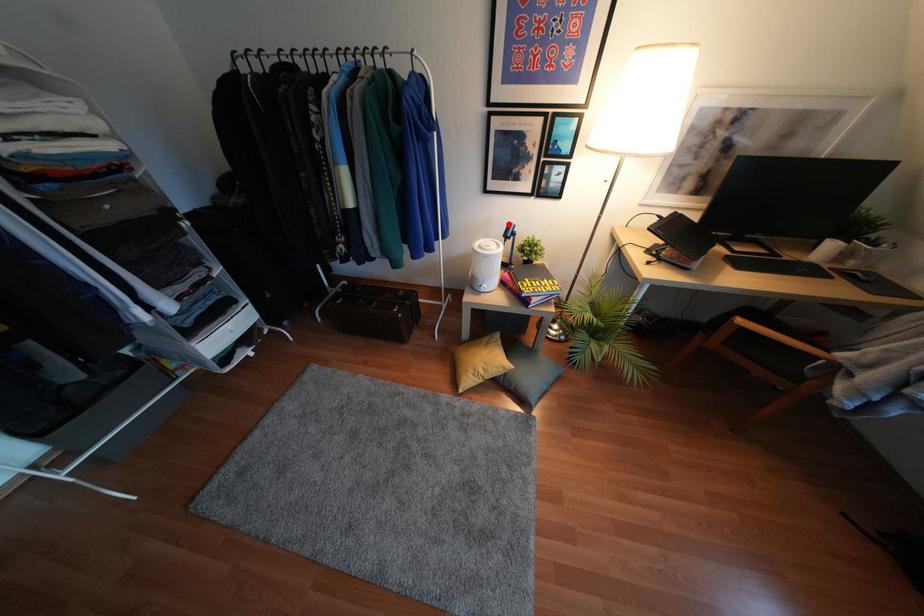
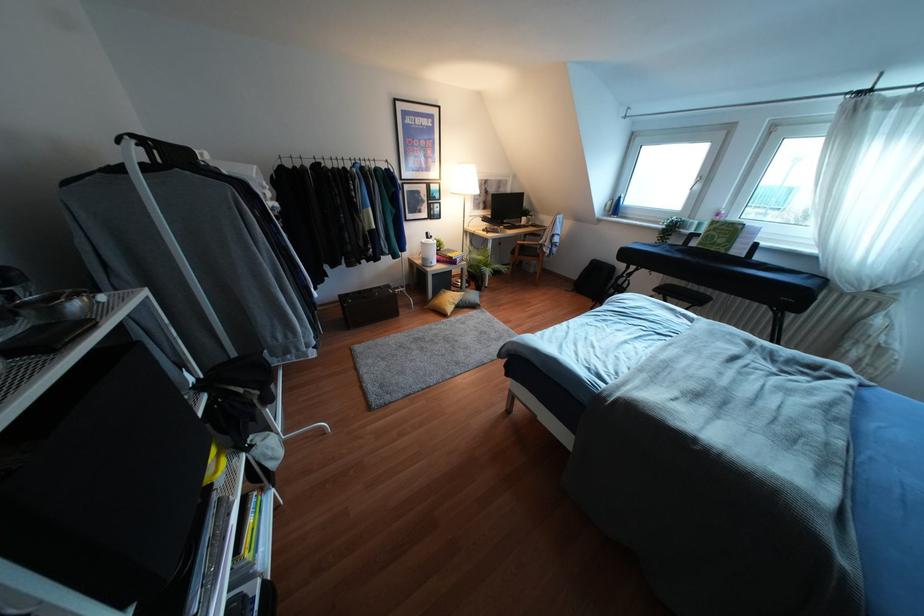
Question: A red point is marked in image1. In image2, is the corresponding 3D point closer to the camera or farther? Reply with the corresponding letter.

Choices:
 (A) The corresponding 3D point is closer.
 (B) The corresponding 3D point is farther.

Answer: (A)